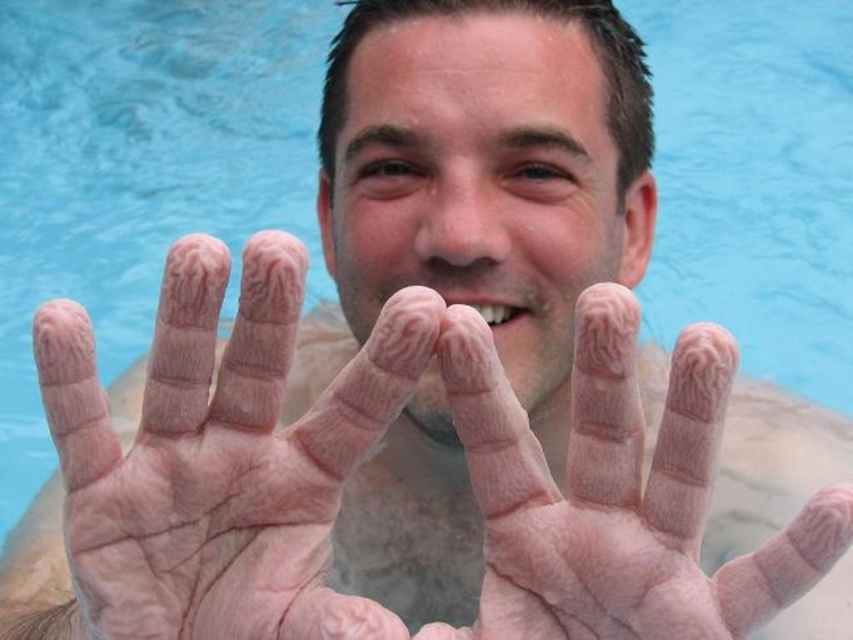
You are a photographer trying to capture the pale skin palm at center in the swimming pool scene. Where exactly should you focus your camera to ensure the palm is in the center of your shot?

The pale skin palm at center is located at point (221, 456), so you should focus your camera at those coordinates to center the palm in your shot.

You are a photographer trying to capture the details of the hands in the pool. You notice the pale skin palm at center and the pink flesh at center. Which part of the hand is higher up in the image?

The pale skin palm at center is taller than the pink flesh at center, so the pale skin palm at center is higher up in the image.